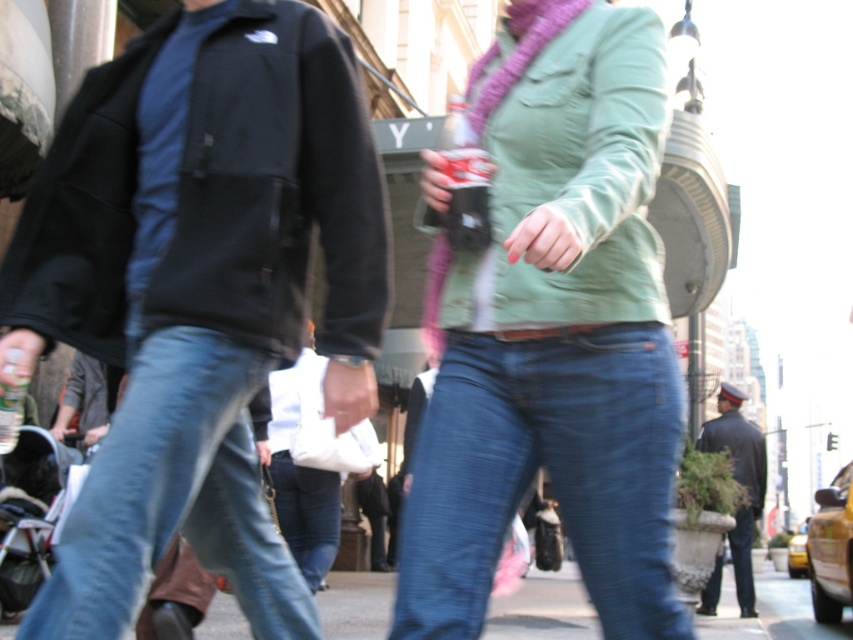
You are a photographer trying to capture a candid shot of the blue denim jeans at lower left and the denim jeans at center in the urban street scene. Since both are moving, which pair of jeans should you focus on first to ensure they are in frame before the other moves out of the shot?

The blue denim jeans at lower left is in front of the denim jeans at center, so you should focus on capturing the blue denim jeans at lower left first as it is closer and more likely to move out of frame sooner.

You are a photographer standing at the center of the urban street scene. You want to take a photo of the matte green jacket at center. Where should you aim your camera to capture it?

You should aim your camera at point coordinates (555, 337) to capture the matte green jacket at center.

You are standing at the origin point of the image. Which of the two points, point [184,524] or point [738,536], is closer to you?

Point [184,524] is in front of point [738,536], so it is closer to you.